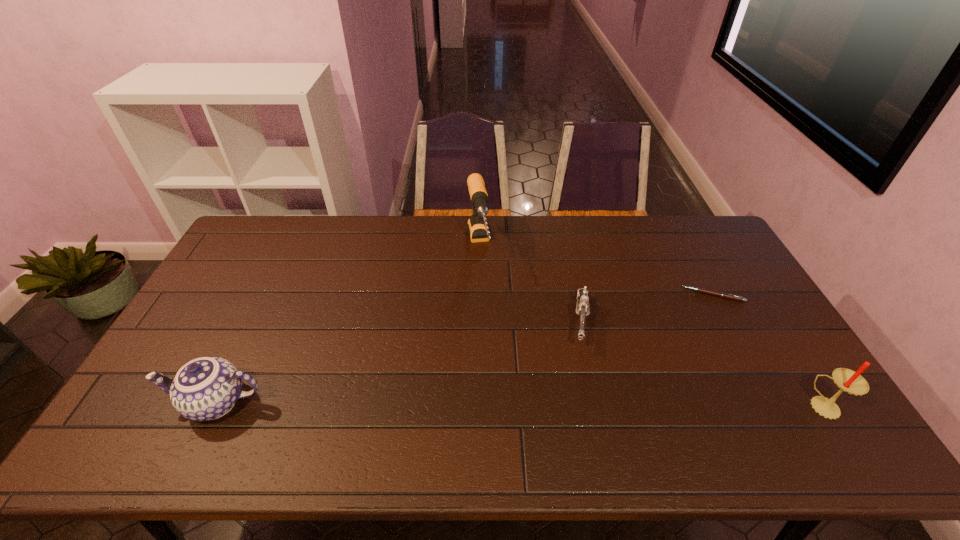
At what (x,y) coordinates should I click in order to perform the action: click on vacant space located on the handle side of the drill. Please return your answer as a coordinate pair (x, y). The image size is (960, 540). Looking at the image, I should click on (496, 363).

Identify the location of object that is at the far edge. (478, 230).

Locate an element on the screen. The image size is (960, 540). chinaware present at the near edge is located at coordinates (207, 388).

At what (x,y) coordinates should I click in order to perform the action: click on candle located at the near edge. Please return your answer as a coordinate pair (x, y). This screenshot has height=540, width=960. Looking at the image, I should click on (847, 380).

I want to click on object positioned at the left edge, so click(x=207, y=388).

Identify the location of candle that is positioned at the right edge. (847, 380).

Identify the location of pen at the right edge. This screenshot has height=540, width=960. (720, 294).

What are the coordinates of `object at the near left corner` in the screenshot? It's located at (207, 388).

Identify the location of object situated at the near right corner. This screenshot has height=540, width=960. (847, 380).

The image size is (960, 540). In the image, there is a desktop. In order to click on vacant space at the far edge in this screenshot , I will do `click(635, 255)`.